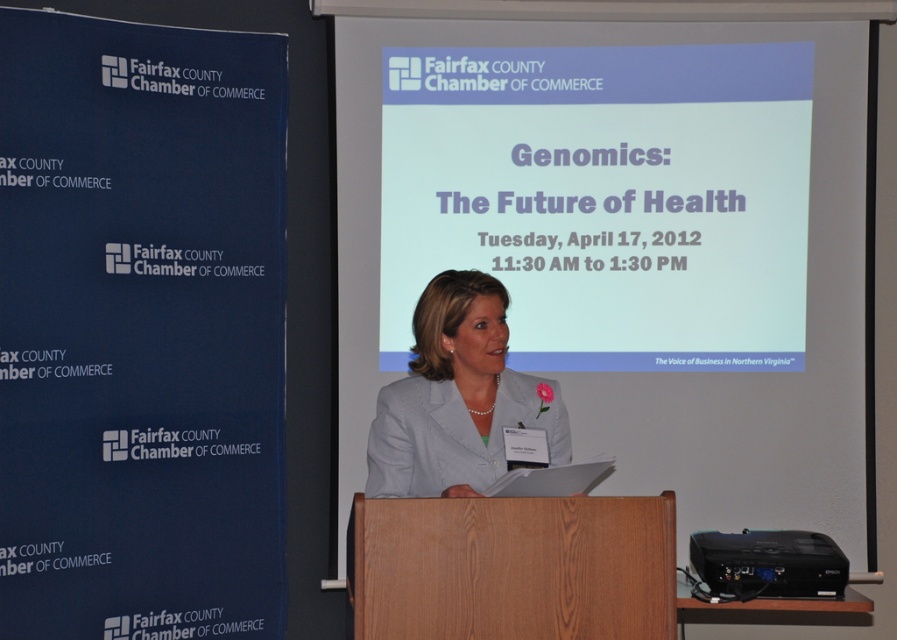
The height and width of the screenshot is (640, 897). Find the location of `white matte projector screen at center`. white matte projector screen at center is located at coordinates (626, 243).

Locate an element on the screen. Image resolution: width=897 pixels, height=640 pixels. white matte projector screen at center is located at coordinates [x=626, y=243].

Identify the location of white matte projector screen at center. (626, 243).

Can you confirm if white paper at center is thinner than white fabric jacket at center?

Incorrect, white paper at center's width is not less than white fabric jacket at center's.

Between white paper at center and white fabric jacket at center, which one is positioned higher?

white paper at center is higher up.

Identify the location of white paper at center. The height and width of the screenshot is (640, 897). (604, 198).

Is wooden podium at center closer to the viewer compared to white fabric jacket at center?

Yes, it is in front of white fabric jacket at center.

Can you confirm if wooden podium at center is thinner than white fabric jacket at center?

No, wooden podium at center is not thinner than white fabric jacket at center.

Locate an element on the screen. The image size is (897, 640). wooden podium at center is located at coordinates (511, 566).